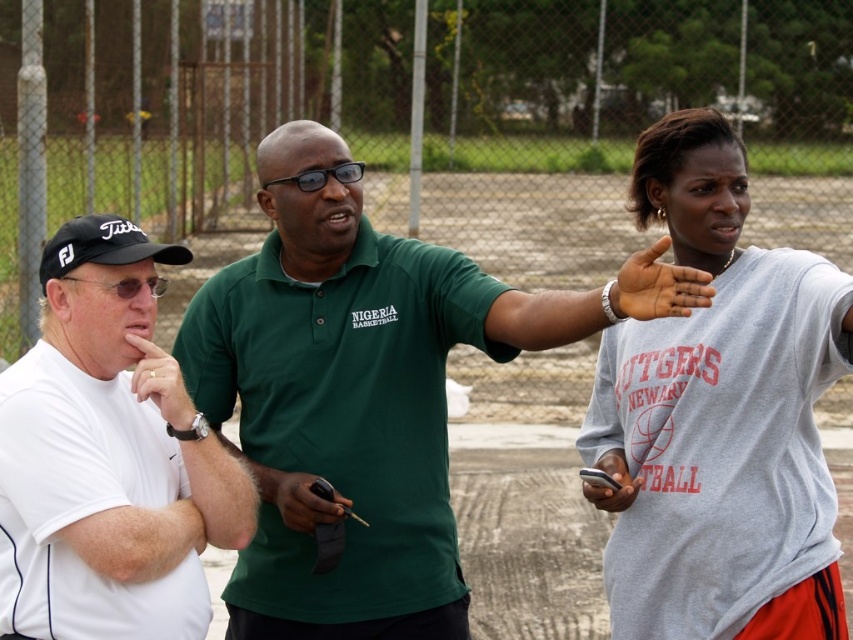
Does gray cotton shirt at upper right appear on the right side of dark skin palm at center?

Correct, you'll find gray cotton shirt at upper right to the right of dark skin palm at center.

Locate an element on the screen. gray cotton shirt at upper right is located at coordinates (721, 416).

Does green matte polo shirt at center lie in front of gold metallic ring at left?

Yes.

Which of these two, green matte polo shirt at center or gold metallic ring at left, stands taller?

Standing taller between the two is green matte polo shirt at center.

Consider the image. Who is more distant from viewer, (x=334, y=157) or (x=181, y=419)?

The point (x=334, y=157) is more distant.

The height and width of the screenshot is (640, 853). In order to click on green matte polo shirt at center in this screenshot , I will do `click(351, 394)`.

Can you confirm if gold metallic ring at left is positioned to the left of black matte pen at center?

Correct, you'll find gold metallic ring at left to the left of black matte pen at center.

Identify the location of gold metallic ring at left. (160, 381).